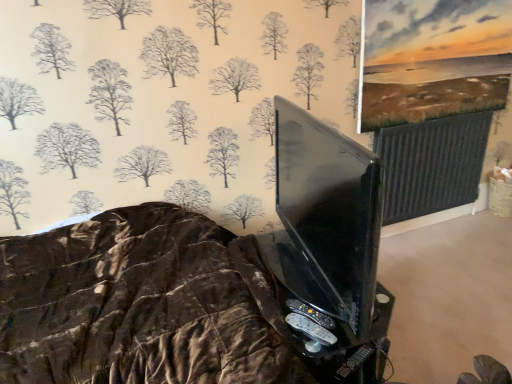
Question: From a real-world perspective, is black plastic game controller at lower center physically located above or below black glossy tv stand at lower center?

Choices:
 (A) above
 (B) below

Answer: (A)

Question: In terms of size, does black plastic game controller at lower center appear bigger or smaller than black glossy tv stand at lower center?

Choices:
 (A) small
 (B) big

Answer: (A)

Question: Considering the positions of black plastic game controller at lower center and black glossy tv stand at lower center in the image, is black plastic game controller at lower center wider or thinner than black glossy tv stand at lower center?

Choices:
 (A) wide
 (B) thin

Answer: (B)

Question: Considering the positions of point (345, 322) and point (326, 316), is point (345, 322) closer or farther from the camera than point (326, 316)?

Choices:
 (A) farther
 (B) closer

Answer: (B)

Question: Visually, is black glossy tv stand at lower center positioned to the left or to the right of black plastic game controller at lower center?

Choices:
 (A) left
 (B) right

Answer: (B)

Question: Is black glossy tv stand at lower center wider or thinner than black plastic game controller at lower center?

Choices:
 (A) thin
 (B) wide

Answer: (B)

Question: From a real-world perspective, relative to black plastic game controller at lower center, is black glossy tv stand at lower center vertically above or below?

Choices:
 (A) above
 (B) below

Answer: (B)